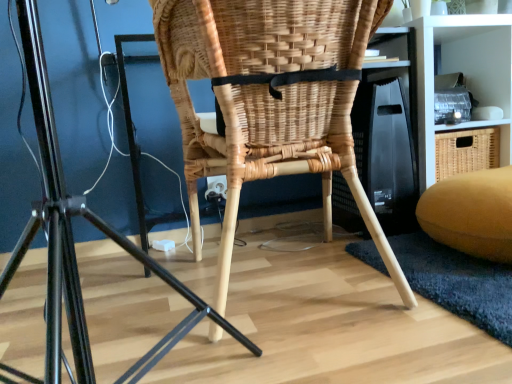
Locate an element on the screen. This screenshot has width=512, height=384. free point below natural woven chair at center (from a real-world perspective) is located at coordinates (292, 280).